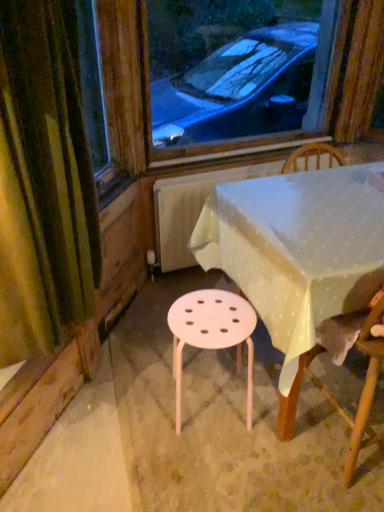
Locate an element on the screen. This screenshot has height=512, width=384. free point in front of pink plastic stool at center is located at coordinates tap(211, 467).